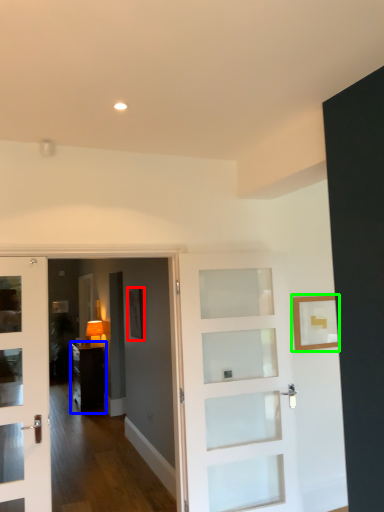
Question: Considering the real-world distances, which object is closest to picture frame (highlighted by a red box)? furniture (highlighted by a blue box) or picture frame (highlighted by a green box).

Choices:
 (A) furniture
 (B) picture frame

Answer: (B)